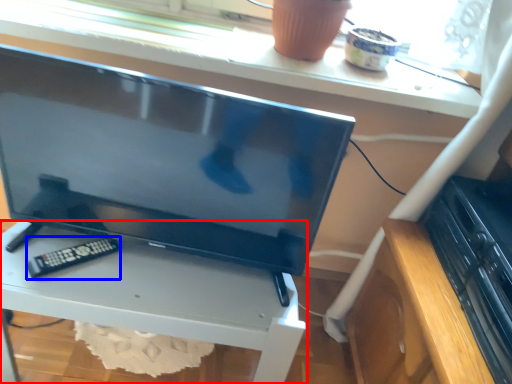
Question: Which object is further to the camera taking this photo, furniture (highlighted by a red box) or control (highlighted by a blue box)?

Choices:
 (A) furniture
 (B) control

Answer: (B)